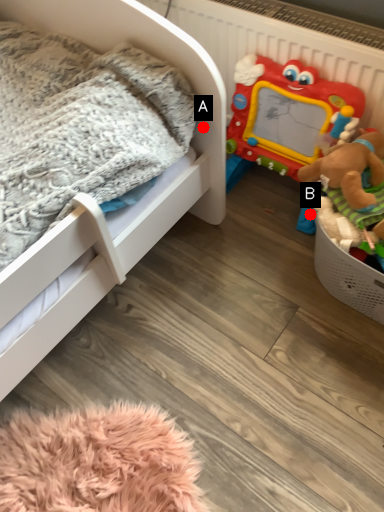
Question: Two points are circled on the image, labeled by A and B beside each circle. Which point appears closest to the camera in this image?

Choices:
 (A) A is closer
 (B) B is closer

Answer: (A)